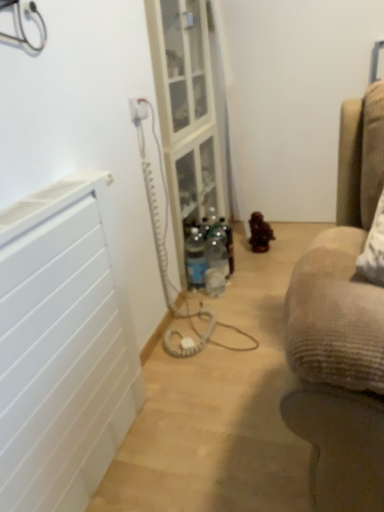
Question: From their relative heights in the image, would you say clear glass shelf at center is taller or shorter than clear plastic bottle at center?

Choices:
 (A) tall
 (B) short

Answer: (A)

Question: From a real-world perspective, is clear glass shelf at center above or below clear plastic bottle at center?

Choices:
 (A) above
 (B) below

Answer: (A)

Question: Which of these objects is positioned farthest from the clear glass shelf at center?

Choices:
 (A) white matte radiator at left
 (B) white plastic electric outlet at upper center
 (C) clear plastic bottle at center

Answer: (A)

Question: Based on their relative distances, which object is farther from the clear plastic bottle at center?

Choices:
 (A) white plastic electric outlet at upper center
 (B) white matte radiator at left
 (C) clear glass shelf at center

Answer: (B)